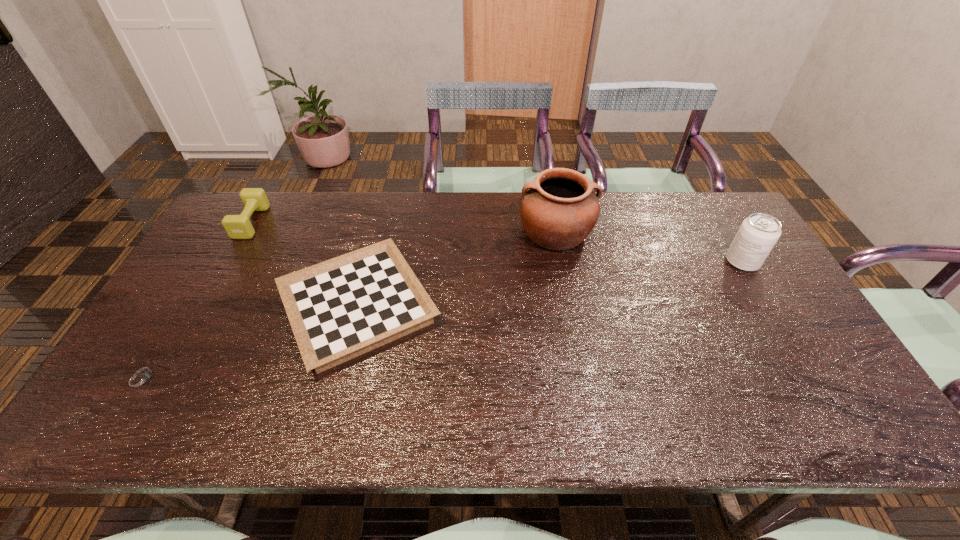
Find the location of a particular element. empty space that is in between the second tallest object and the watch is located at coordinates [x=443, y=320].

At what (x,y) coordinates should I click in order to perform the action: click on free space between the tallest object and the second shortest object. Please return your answer as a coordinate pair (x, y). The image size is (960, 540). Looking at the image, I should click on (457, 269).

Identify the location of object that ranks as the fourth closest to the dumbbell. The image size is (960, 540). (758, 233).

Locate an element on the screen. the second closest object to the shortest object is located at coordinates (254, 199).

Where is `vacant space that satisfies the following two spatial constraints: 1. on the front side of the third shortest object; 2. on the left side of the second shortest object`? Image resolution: width=960 pixels, height=540 pixels. vacant space that satisfies the following two spatial constraints: 1. on the front side of the third shortest object; 2. on the left side of the second shortest object is located at coordinates point(204,307).

Where is `vacant space that satisfies the following two spatial constraints: 1. on the front side of the third object from left to right; 2. on the face of the shortest object`? The width and height of the screenshot is (960, 540). vacant space that satisfies the following two spatial constraints: 1. on the front side of the third object from left to right; 2. on the face of the shortest object is located at coordinates [x=341, y=377].